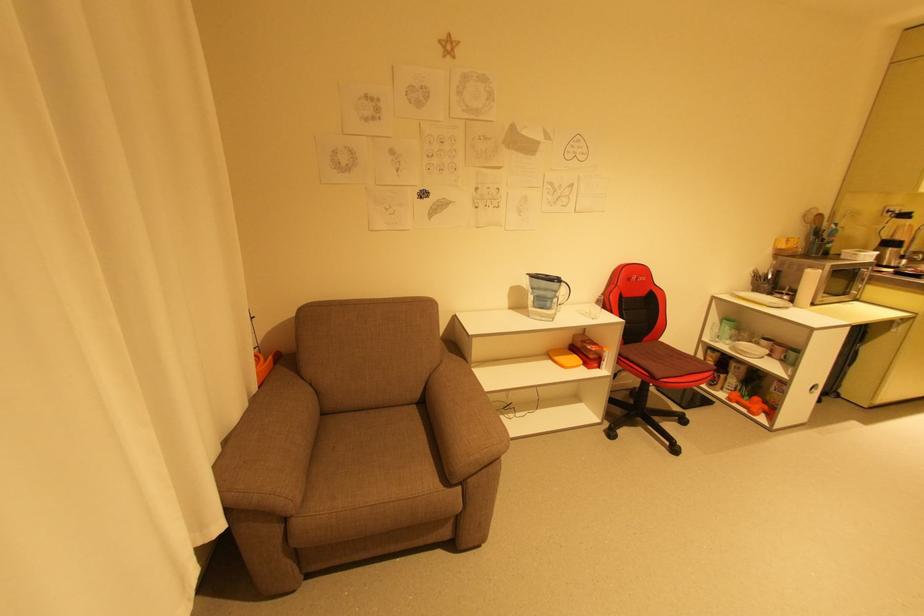
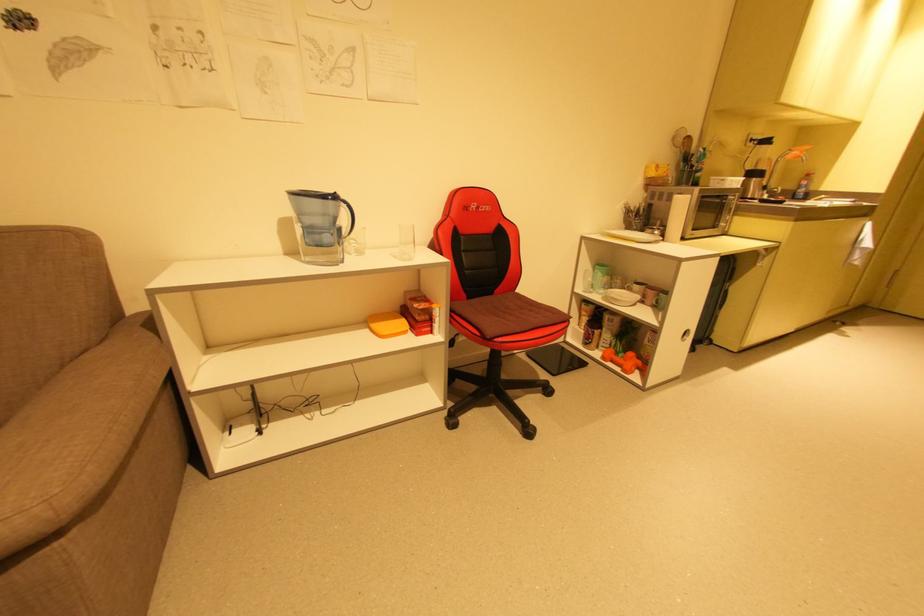
Locate, in the second image, the point that corresponds to the point at 554,362 in the first image.

(371, 331)